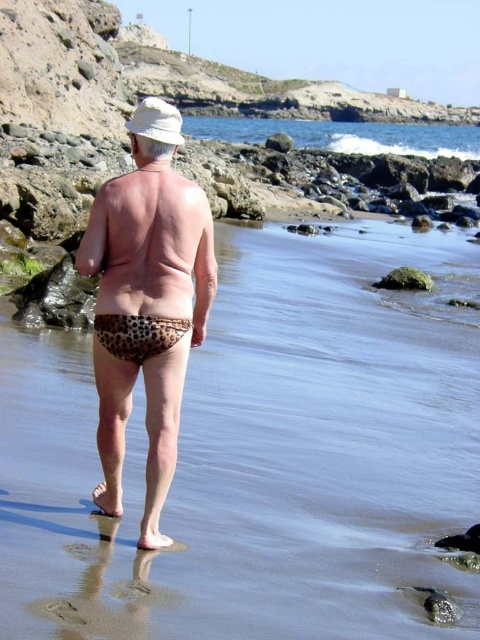
Question: Where is leopard print swimwear at center located in relation to blue water at upper center in the image?

Choices:
 (A) above
 (B) below

Answer: (B)

Question: Which object is positioned farthest from the blue water at upper center?

Choices:
 (A) leopard print fabric at lower center
 (B) leopard print swimwear at center

Answer: (A)

Question: Is blue water at upper center in front of leopard print fabric at lower center?

Choices:
 (A) yes
 (B) no

Answer: (B)

Question: Which point is farther to the camera?

Choices:
 (A) leopard print fabric at lower center
 (B) blue water at upper center

Answer: (B)

Question: Can you confirm if leopard print swimwear at center is positioned to the right of blue water at upper center?

Choices:
 (A) no
 (B) yes

Answer: (A)

Question: Which point is closer to the camera taking this photo?

Choices:
 (A) (140, 330)
 (B) (132, 346)

Answer: (A)